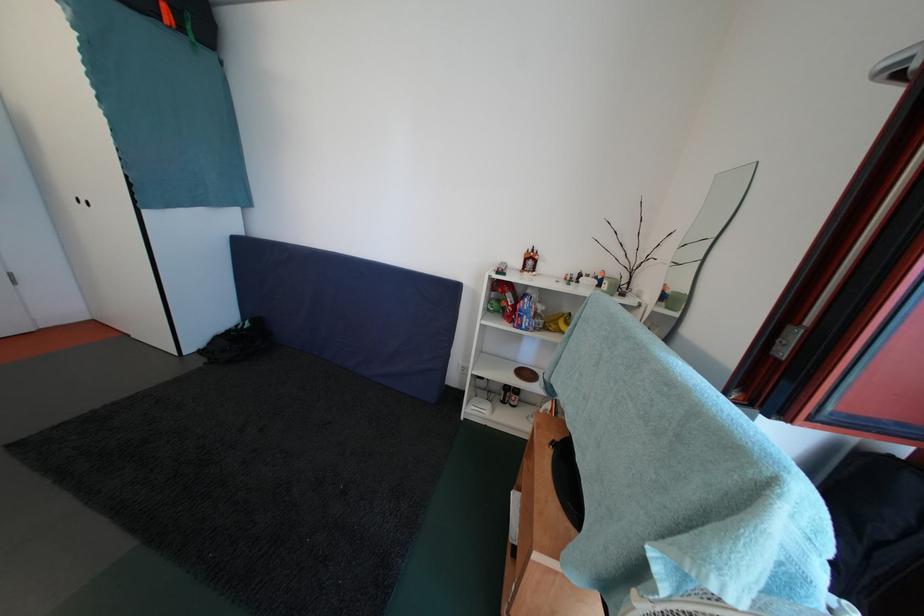
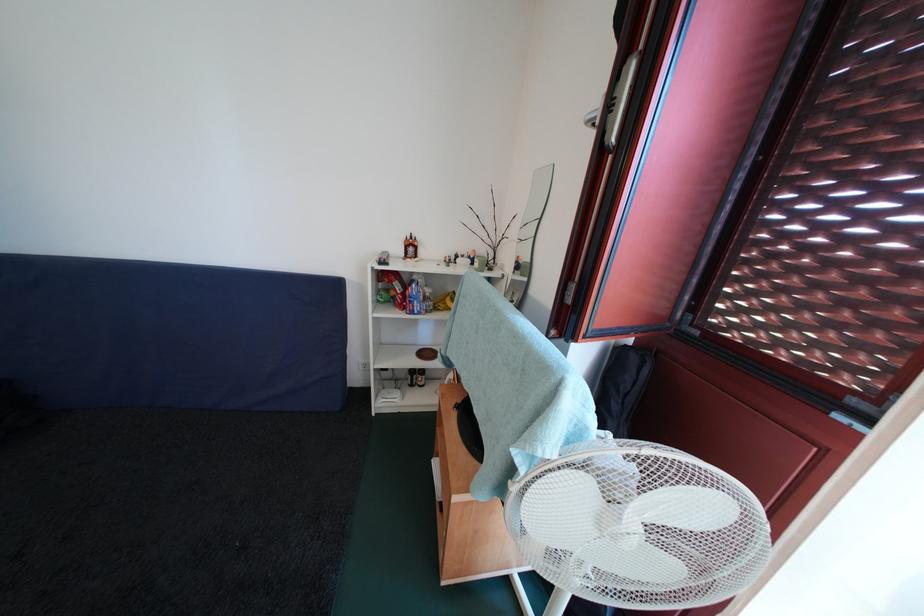
Where in the second image is the point corresponding to (516,399) from the first image?

(421, 382)